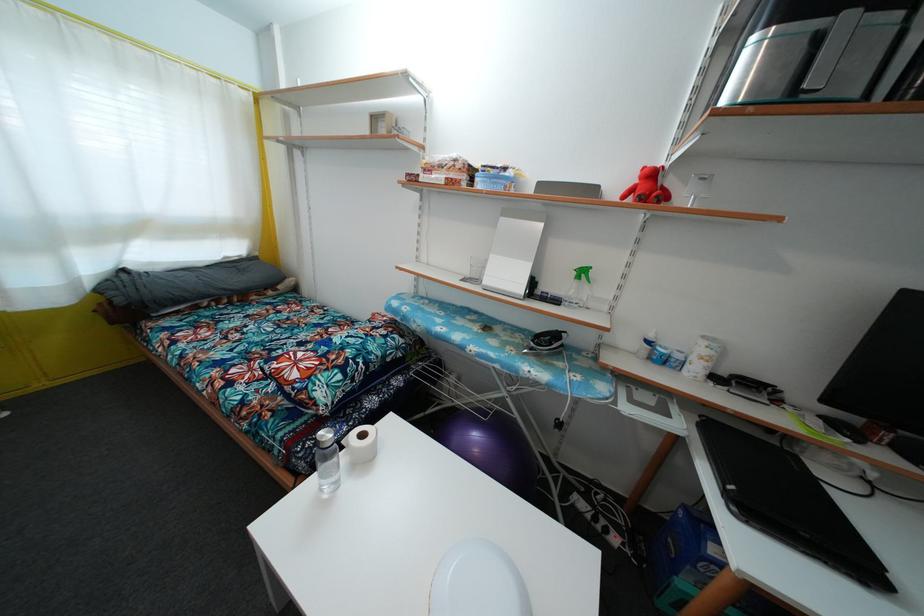
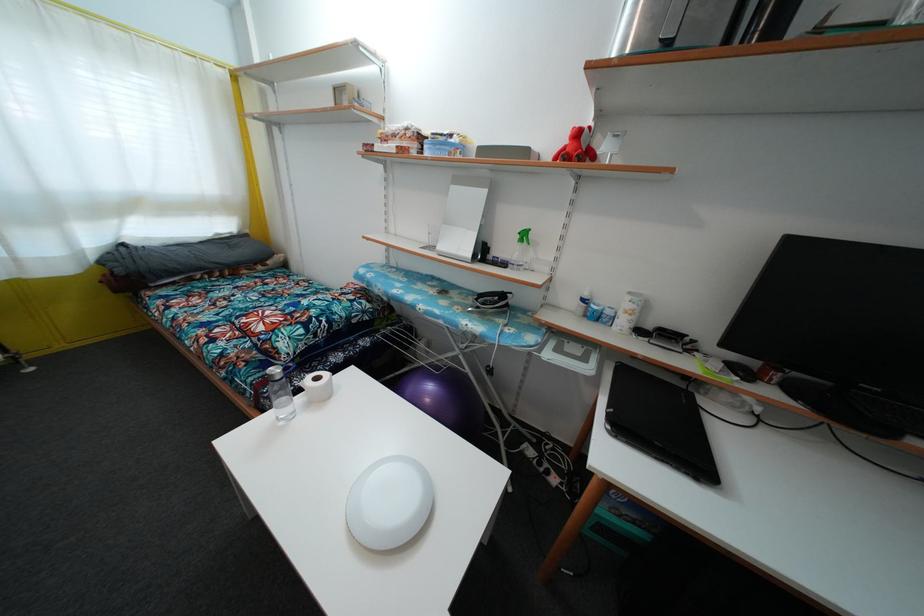
Where in the second image is the point corresponding to point 520,341 from the first image?

(475, 304)